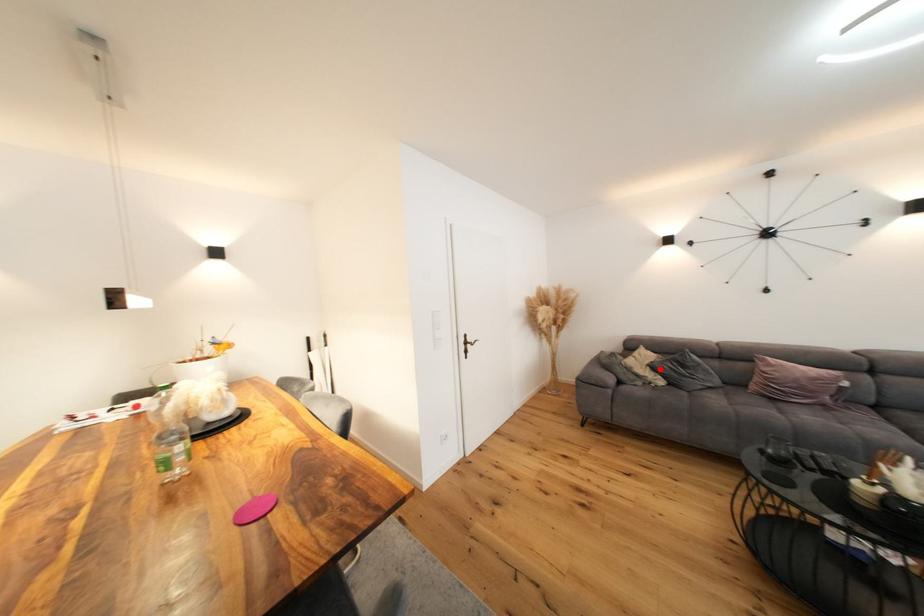
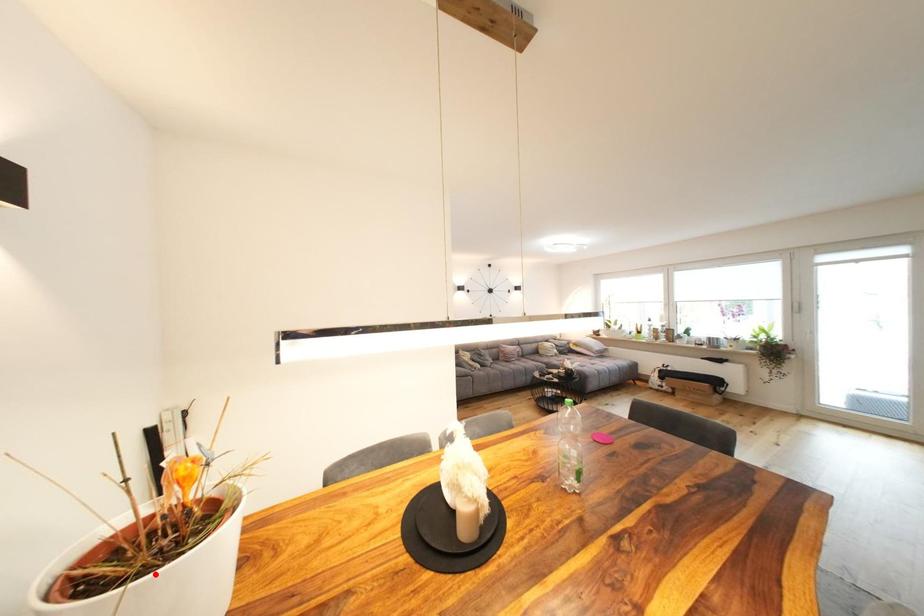
I am providing you with two images of the same scene from different viewpoints. A red point is marked on the first image and another point is marked on the second image. Does the point marked in image1 correspond to the same location as the one in image2?

No